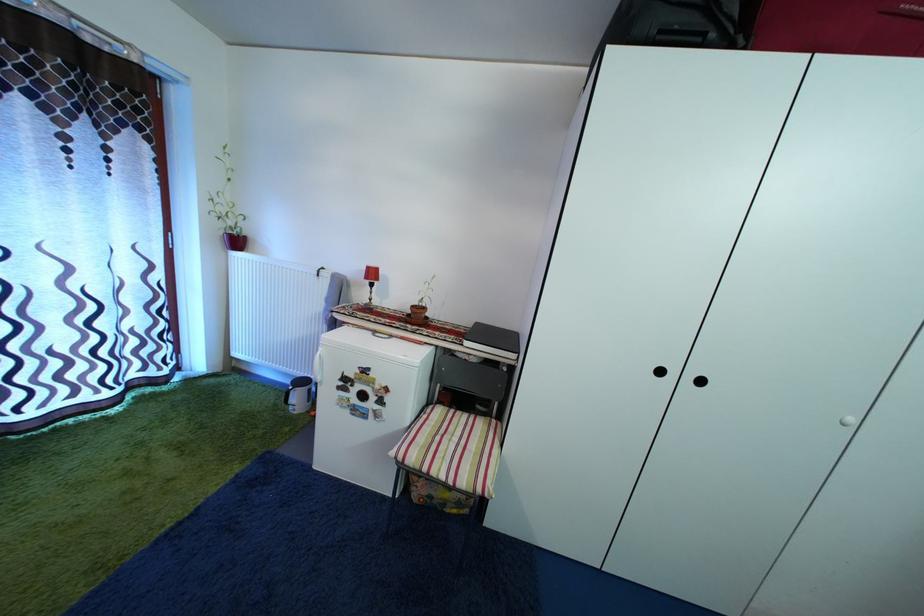
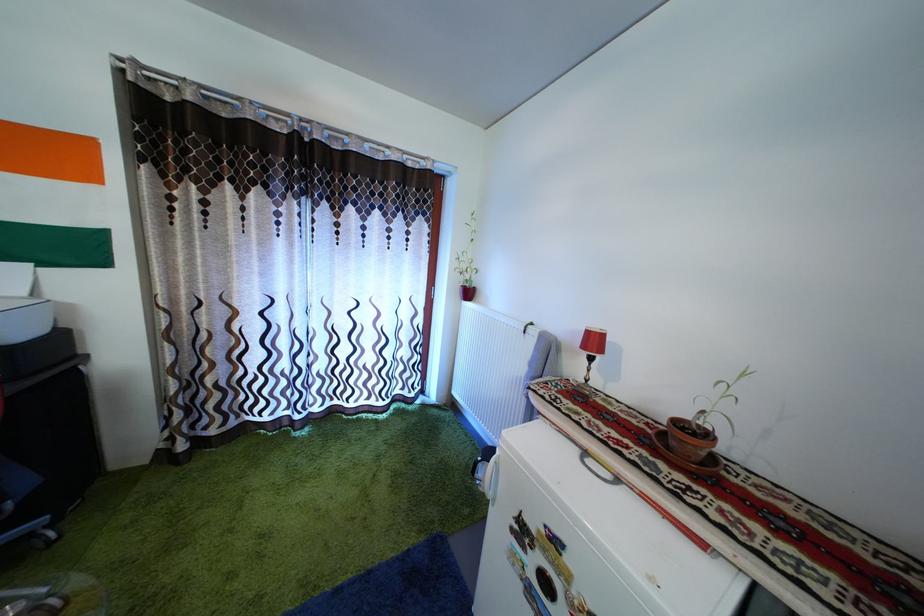
Where in the second image is the point corresponding to point (432, 315) from the first image?

(715, 442)